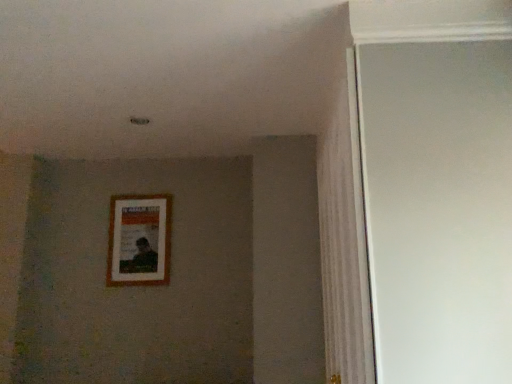
Question: Does white glossy door at right contain wooden picture frame at center?

Choices:
 (A) yes
 (B) no

Answer: (B)

Question: Does white glossy door at right have a greater width compared to wooden picture frame at center?

Choices:
 (A) yes
 (B) no

Answer: (A)

Question: Is white glossy door at right positioned beyond the bounds of wooden picture frame at center?

Choices:
 (A) no
 (B) yes

Answer: (B)

Question: Is white glossy door at right aimed at wooden picture frame at center?

Choices:
 (A) no
 (B) yes

Answer: (B)

Question: From the image's perspective, is white glossy door at right above wooden picture frame at center?

Choices:
 (A) no
 (B) yes

Answer: (B)

Question: Is white glossy door at right turned away from wooden picture frame at center?

Choices:
 (A) no
 (B) yes

Answer: (A)

Question: Does wooden picture frame at center come in front of white glossy door at right?

Choices:
 (A) yes
 (B) no

Answer: (B)

Question: Are wooden picture frame at center and white glossy door at right far apart?

Choices:
 (A) no
 (B) yes

Answer: (B)

Question: From the image's perspective, is wooden picture frame at center on top of white glossy door at right?

Choices:
 (A) no
 (B) yes

Answer: (A)

Question: Is wooden picture frame at center positioned with its back to white glossy door at right?

Choices:
 (A) no
 (B) yes

Answer: (A)

Question: Considering the relative positions of wooden picture frame at center and white glossy door at right in the image provided, is wooden picture frame at center to the right of white glossy door at right from the viewer's perspective?

Choices:
 (A) yes
 (B) no

Answer: (B)

Question: Can you confirm if wooden picture frame at center is thinner than white glossy door at right?

Choices:
 (A) yes
 (B) no

Answer: (A)

Question: Is point (455, 183) positioned closer to the camera than point (111, 256)?

Choices:
 (A) closer
 (B) farther

Answer: (A)